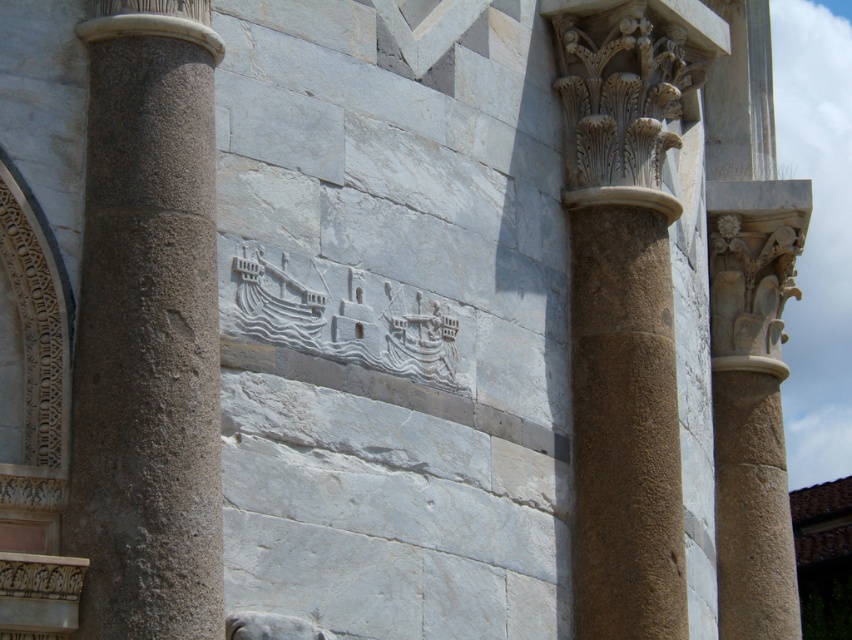
You are an architect examining the stone building. You notice the gray stone column at left and the brown stone column at right. Which column is closer to you?

The gray stone column at left is closer to you because it is in front of the brown stone column at right.

You are an architect examining the stone building. You notice the gray stone column at left and the smooth stone column at upper right. Which column is located to the left of the other?

The gray stone column at left is positioned on the left side of smooth stone column at upper right.

You are standing in front of the stone building and want to take a photo of the gray stone column at left. Where should you position yourself to capture it in the center of your camera viewfinder?

To center the gray stone column at left in your camera viewfinder, position yourself directly in front of it, aligning the column with the center point of your viewfinder. Since its 2D coordinates are at point [147,328], this placement ensures optimal framing.